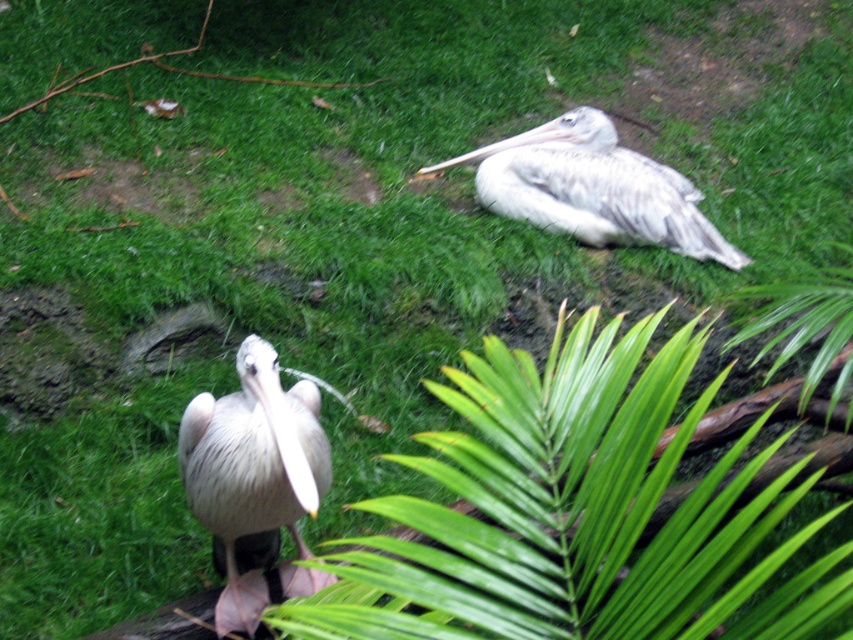
You are a wildlife photographer aiming to capture both the white feathered pelican at center and the white feathered pelican at upper right in a single frame. Based on their sizes in the image, which pelican would you need to adjust your camera settings for to ensure proper focus and exposure?

The white feathered pelican at upper right is wider than the white feathered pelican at center. Since it is larger, you may need to adjust your camera settings to ensure proper focus and exposure for the wider pelican to capture both effectively.

You are a wildlife photographer aiming to capture both pelicans in a single frame. Given that the white feathered pelican at center is closer to you, will you need to adjust your camera focus to include the white feathered pelican at upper right in focus?

The white feathered pelican at center is closer to you, so adjusting the focus to include the white feathered pelican at upper right may be necessary since it is farther away and larger in size.

You are a photographer aiming to capture both white feathered pelican at center and white feathered pelican at upper right in a single shot. Based on their positions, which pelican is positioned to the left side of the other?

The white feathered pelican at center is positioned to the left of the white feathered pelican at upper right.